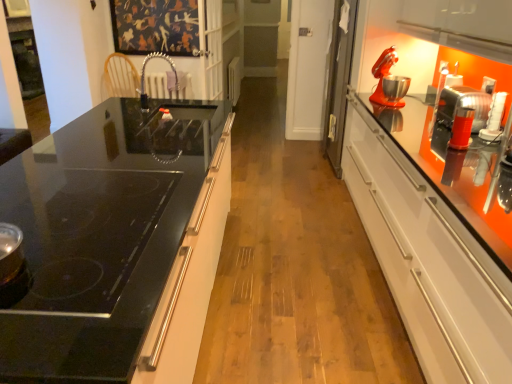
Question: Should I look upward or downward to see white plastic radiator at center, positioned as the second appliance in front-to-back order?

Choices:
 (A) down
 (B) up

Answer: (B)

Question: Does satin nickel faucet at center contain matte red mixer at upper right?

Choices:
 (A) no
 (B) yes

Answer: (A)

Question: Is satin nickel faucet at center completely or partially outside of matte red mixer at upper right?

Choices:
 (A) no
 (B) yes

Answer: (B)

Question: Does satin nickel faucet at center lie in front of matte red mixer at upper right?

Choices:
 (A) yes
 (B) no

Answer: (A)

Question: Does satin nickel faucet at center have a lesser height compared to matte red mixer at upper right?

Choices:
 (A) yes
 (B) no

Answer: (A)

Question: Can you confirm if satin nickel faucet at center is positioned to the right of matte red mixer at upper right?

Choices:
 (A) no
 (B) yes

Answer: (A)

Question: From the image's perspective, does satin nickel faucet at center appear higher than matte red mixer at upper right?

Choices:
 (A) yes
 (B) no

Answer: (B)

Question: Can you confirm if matte red mixer at upper right is shorter than black glass cooktop at left?

Choices:
 (A) yes
 (B) no

Answer: (A)

Question: Does matte red mixer at upper right have a smaller size compared to black glass cooktop at left?

Choices:
 (A) no
 (B) yes

Answer: (B)

Question: Is matte red mixer at upper right not within black glass cooktop at left?

Choices:
 (A) yes
 (B) no

Answer: (A)

Question: Can you confirm if matte red mixer at upper right is thinner than black glass cooktop at left?

Choices:
 (A) no
 (B) yes

Answer: (B)

Question: From the image's perspective, does matte red mixer at upper right appear lower than black glass cooktop at left?

Choices:
 (A) no
 (B) yes

Answer: (A)

Question: Is the depth of matte red mixer at upper right greater than that of black glass cooktop at left?

Choices:
 (A) yes
 (B) no

Answer: (A)

Question: Does orange metallic mixer at right, the 1th appliance in the bottom-to-top sequence, have a greater height compared to satin nickel faucet at center?

Choices:
 (A) no
 (B) yes

Answer: (A)